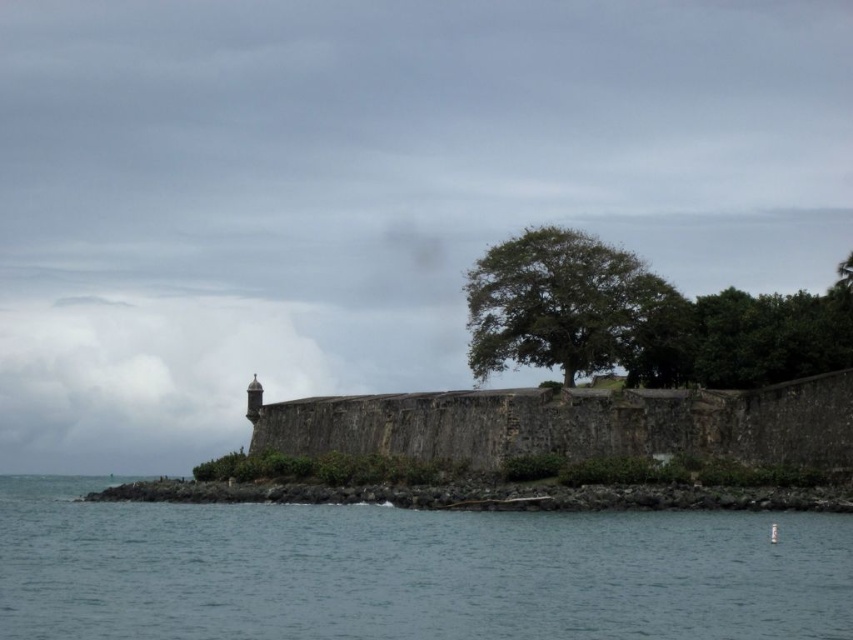
You are standing at the edge of the rocky shoreline looking towards the weathered stone fort at center and the green leafy tree at center. Which object is closer to you?

The weathered stone fort at center is closer to you because it is positioned in front of the green leafy tree at center.

You are standing at the point marked by the coordinates point (x=572, y=424) in the coastal scene. What structure are you positioned at?

You are positioned at the weathered stone fort at center marked by point (x=572, y=424).

You are standing at the edge of the coastal scene and want to cross to the other side. The blue water at lower left and the green leafy tree at center are in your path. Which one has a wider path to walk through?

The blue water at lower left has a wider path than the green leafy tree at center because its width surpasses the tree.